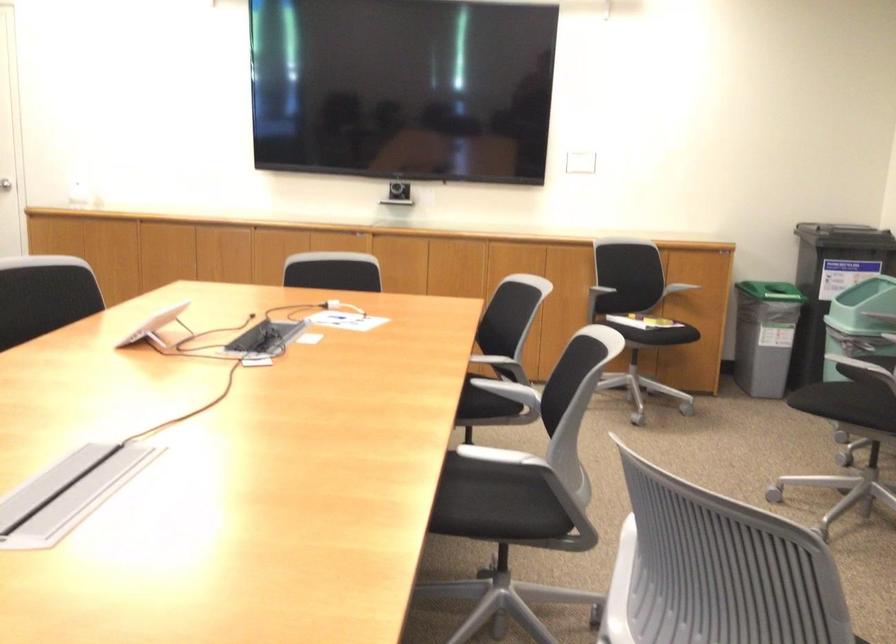
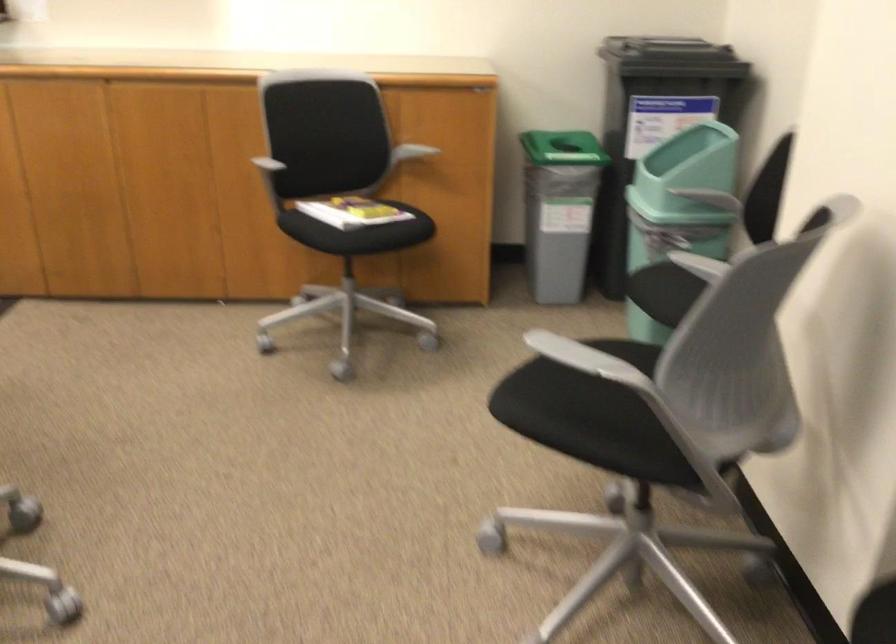
Find the pixel in the second image that matches [644,303] in the first image.

(355, 212)